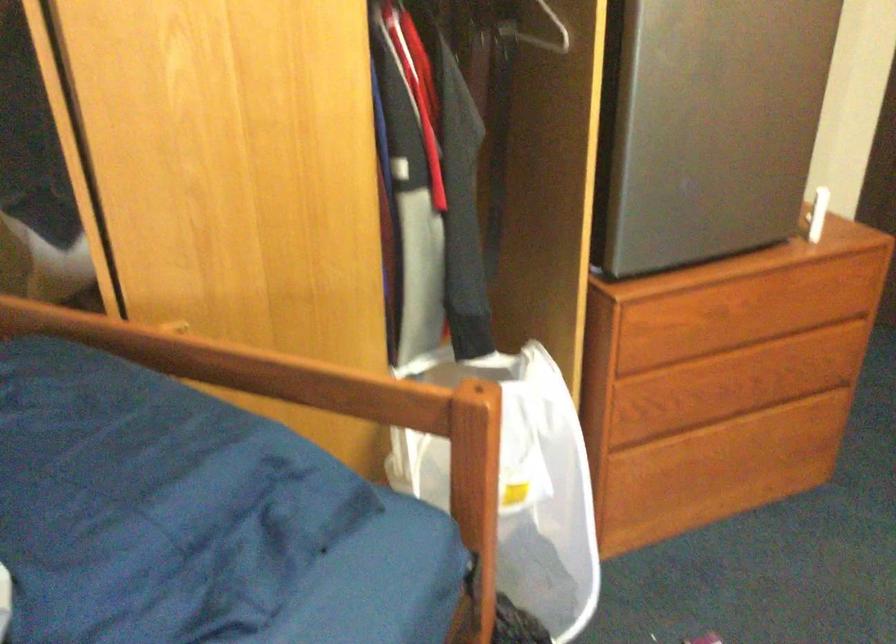
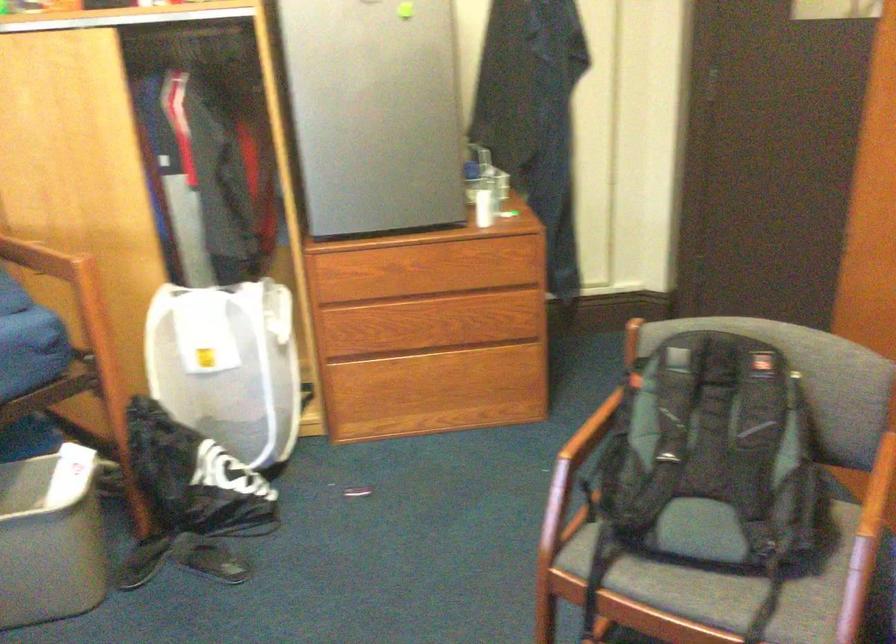
Locate, in the second image, the point that corresponds to (521,491) in the first image.

(228, 365)